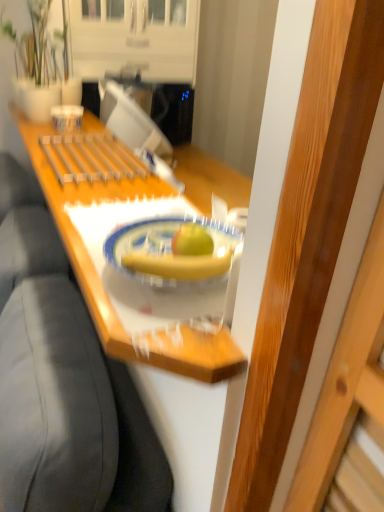
What are the coordinates of `yellow matte banana at center` in the screenshot? It's located at (180, 264).

You are a GUI agent. You are given a task and a screenshot of the screen. Output one action in this format:
    pyautogui.click(x=<x>, y=<y>)
    Task: Click on the matte white vase at upper left
    The width and height of the screenshot is (384, 512).
    Given the screenshot: What is the action you would take?
    pyautogui.click(x=42, y=63)

How distant is porcelain plate at center from wooden tray at center?

porcelain plate at center is 23.74 centimeters from wooden tray at center.

Is porcelain plate at center oriented towards wooden tray at center?

No, porcelain plate at center is not aimed at wooden tray at center.

Locate an element on the screen. plate lying behind the wooden tray at center is located at coordinates (165, 247).

Does yellow matte banana at center have a greater height compared to wooden tray at center?

Incorrect, the height of yellow matte banana at center is not larger of that of wooden tray at center.

How different are the orientations of yellow matte banana at center and wooden tray at center in degrees?

The angle between the facing direction of yellow matte banana at center and the facing direction of wooden tray at center is 0.688 degrees.

Where is `desk below the yellow matte banana at center (from a real-world perspective)`? Image resolution: width=384 pixels, height=512 pixels. desk below the yellow matte banana at center (from a real-world perspective) is located at coordinates click(x=77, y=233).

Between matte white vase at upper left and yellow matte banana at center, which one has larger size?

matte white vase at upper left is bigger.

Relative to yellow matte banana at center, is matte white vase at upper left in front or behind?

Visually, matte white vase at upper left is located behind yellow matte banana at center.

Who is taller, matte white vase at upper left or yellow matte banana at center?

Standing taller between the two is matte white vase at upper left.

In terms of width, does porcelain plate at center look wider or thinner when compared to yellow matte banana at center?

Clearly, porcelain plate at center has more width compared to yellow matte banana at center.

You are a GUI agent. You are given a task and a screenshot of the screen. Output one action in this format:
    pyautogui.click(x=<x>, y=<y>)
    Task: Click on the plate in front of the yellow matte banana at center
    This screenshot has width=384, height=512.
    Given the screenshot: What is the action you would take?
    pyautogui.click(x=165, y=247)

What's the angular difference between porcelain plate at center and yellow matte banana at center's facing directions?

The facing directions of porcelain plate at center and yellow matte banana at center are 0.000696 degrees apart.

Can you confirm if porcelain plate at center is shorter than yellow matte banana at center?

Incorrect, the height of porcelain plate at center does not fall short of that of yellow matte banana at center.

Is porcelain plate at center far from matte white vase at upper left?

porcelain plate at center is positioned a significant distance from matte white vase at upper left.

Where is `houseplant above the porcelain plate at center (from the image's perspective)`? This screenshot has width=384, height=512. houseplant above the porcelain plate at center (from the image's perspective) is located at coordinates (42, 63).

Who is shorter, porcelain plate at center or matte white vase at upper left?

porcelain plate at center is shorter.

Can you confirm if porcelain plate at center is wider than matte white vase at upper left?

In fact, porcelain plate at center might be narrower than matte white vase at upper left.

Is wooden tray at center spatially inside yellow matte banana at center, or outside of it?

wooden tray at center is not enclosed by yellow matte banana at center.

This screenshot has width=384, height=512. In order to click on banana positioned vertically above the wooden tray at center (from a real-world perspective) in this screenshot , I will do `click(180, 264)`.

Is wooden tray at center bigger than yellow matte banana at center?

Yes.

Is wooden tray at center wider or thinner than yellow matte banana at center?

In the image, wooden tray at center appears to be wider than yellow matte banana at center.

From the image's perspective, which one is positioned lower, matte white vase at upper left or wooden tray at center?

From the image's view, wooden tray at center is below.

Does matte white vase at upper left come in front of wooden tray at center?

No, it is behind wooden tray at center.

Considering the relative sizes of matte white vase at upper left and wooden tray at center in the image provided, is matte white vase at upper left bigger than wooden tray at center?

Actually, matte white vase at upper left might be smaller than wooden tray at center.

The width and height of the screenshot is (384, 512). Find the location of `plate above the wooden tray at center (from the image's perspective)`. plate above the wooden tray at center (from the image's perspective) is located at coordinates coord(165,247).

Locate an element on the screen. Image resolution: width=384 pixels, height=512 pixels. desk in front of the yellow matte banana at center is located at coordinates (77, 233).

Based on the photo, from the image, which object appears to be nearer to porcelain plate at center, yellow matte banana at center or matte white vase at upper left?

The object closer to porcelain plate at center is yellow matte banana at center.

Looking at the image, which one is located closer to matte white vase at upper left, yellow matte banana at center or porcelain plate at center?

The object closer to matte white vase at upper left is porcelain plate at center.

Considering their positions, is yellow matte banana at center positioned closer to matte white vase at upper left than wooden tray at center?

wooden tray at center is closer to matte white vase at upper left.

Considering their positions, is wooden tray at center positioned further to yellow matte banana at center than matte white vase at upper left?

matte white vase at upper left lies further to yellow matte banana at center than the other object.

Based on their spatial positions, is porcelain plate at center or wooden tray at center further from yellow matte banana at center?

wooden tray at center is further to yellow matte banana at center.

Which object lies nearer to the anchor point wooden tray at center, porcelain plate at center or matte white vase at upper left?

The object closer to wooden tray at center is porcelain plate at center.

Estimate the real-world distances between objects in this image. Which object is closer to porcelain plate at center, yellow matte banana at center or wooden tray at center?

The object closer to porcelain plate at center is yellow matte banana at center.

Based on their spatial positions, is wooden tray at center or porcelain plate at center further from matte white vase at upper left?

porcelain plate at center is positioned further to the anchor matte white vase at upper left.

Identify the location of plate between matte white vase at upper left and wooden tray at center vertically. (165, 247).

Find the location of `banana located between porcelain plate at center and matte white vase at upper left in the depth direction`. banana located between porcelain plate at center and matte white vase at upper left in the depth direction is located at coordinates (180, 264).

The width and height of the screenshot is (384, 512). In order to click on plate between wooden tray at center and yellow matte banana at center in this screenshot , I will do `click(165, 247)`.

Find the location of a particular element. This screenshot has width=384, height=512. banana between matte white vase at upper left and wooden tray at center in the vertical direction is located at coordinates point(180,264).